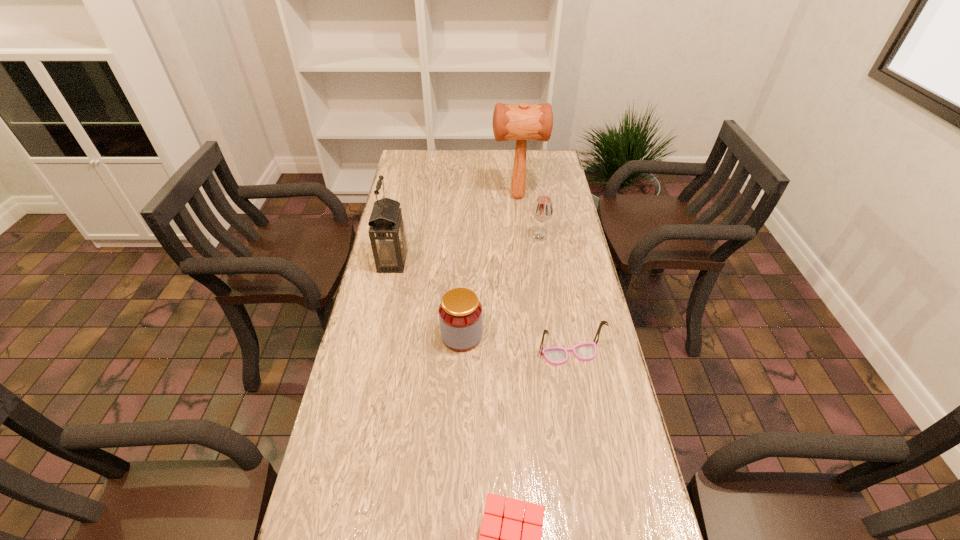
Find the location of a particular element. This screenshot has width=960, height=540. free location located 0.350m on the front-facing side of the lantern is located at coordinates (509, 261).

At what (x,y) coordinates should I click in order to perform the action: click on vacant space located 0.380m on the front of the wineglass. Please return your answer as a coordinate pair (x, y). Looking at the image, I should click on (553, 323).

Where is `free spot located 0.090m on the right of the jar`? The image size is (960, 540). free spot located 0.090m on the right of the jar is located at coordinates (513, 336).

The image size is (960, 540). I want to click on vacant space located 0.290m on the left of the spectacles, so click(x=438, y=354).

I want to click on object located in the left edge section of the desktop, so click(387, 233).

At what (x,y) coordinates should I click in order to perform the action: click on mallet that is at the right edge. Please return your answer as a coordinate pair (x, y). The image size is (960, 540). Looking at the image, I should click on (523, 122).

Locate an element on the screen. This screenshot has width=960, height=540. wineglass that is at the right edge is located at coordinates (542, 211).

Find the location of a particular element. spectacles that is positioned at the right edge is located at coordinates (556, 356).

The width and height of the screenshot is (960, 540). What are the coordinates of `free space at the far edge of the desktop` in the screenshot? It's located at (479, 164).

The height and width of the screenshot is (540, 960). In the image, there is a desktop. What are the coordinates of `vacant space at the left edge` in the screenshot? It's located at (421, 188).